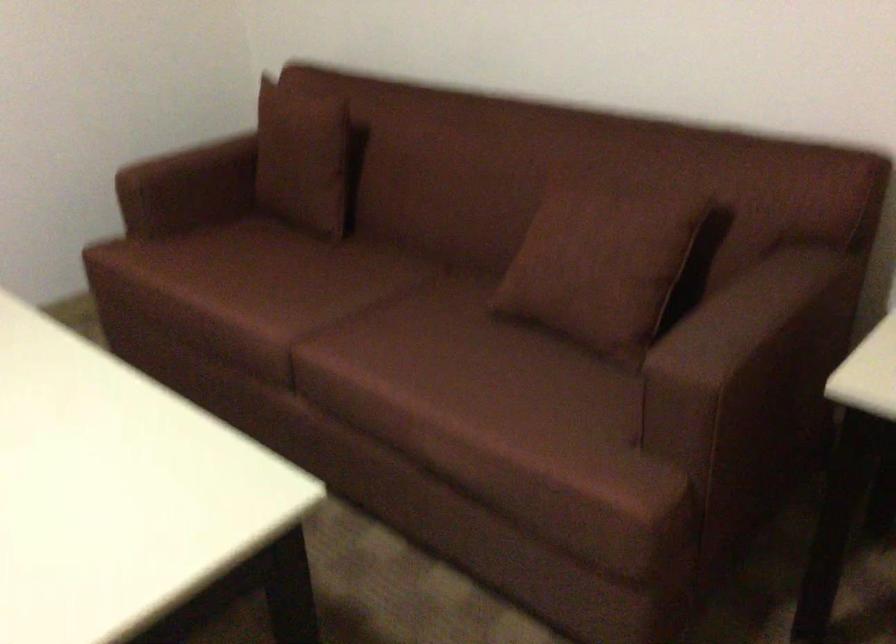
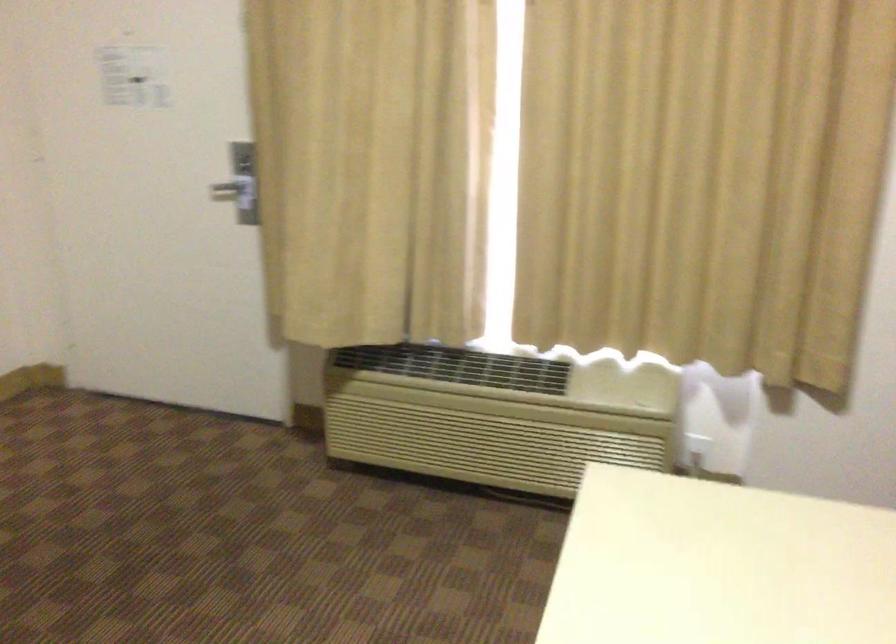
Question: The camera is either moving clockwise (left) or counter-clockwise (right) around the object. The first image is from the beginning of the video and the second image is from the end. Is the camera moving left or right when shooting the video?

Choices:
 (A) Left
 (B) Right

Answer: (B)